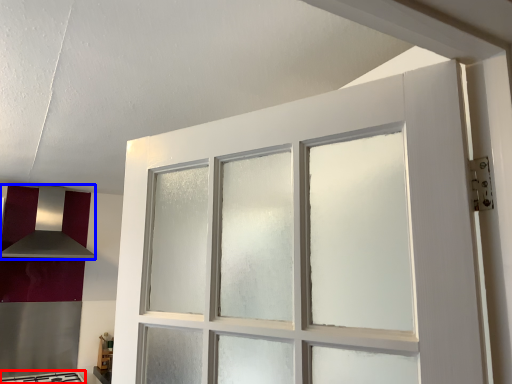
Question: Which of the following is the closest to the observer, gas stove (highlighted by a red box) or exhaust hood (highlighted by a blue box)?

Choices:
 (A) gas stove
 (B) exhaust hood

Answer: (A)